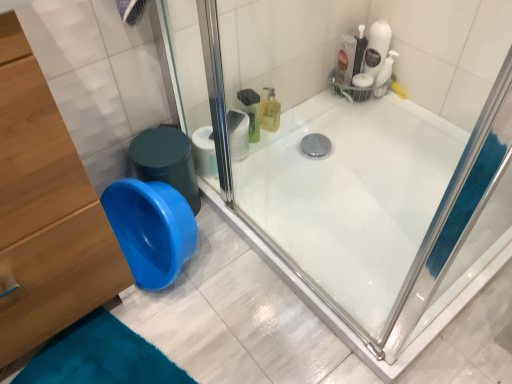
At what (x,y) coordinates should I click in order to perform the action: click on free location in front of white matte toilet paper at upper center. Please return your answer as a coordinate pair (x, y). Looking at the image, I should click on (246, 195).